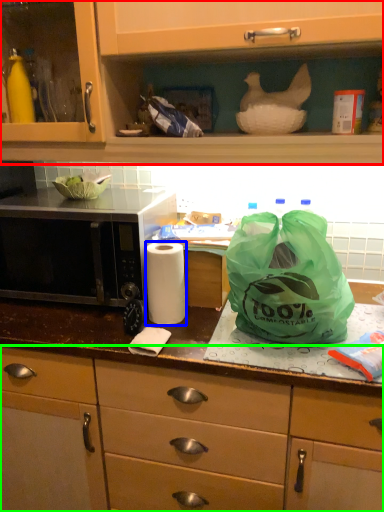
Question: Which object is the farthest from cabinetry (highlighted by a red box)? Choose among these: paper towel (highlighted by a blue box) or cabinetry (highlighted by a green box).

Choices:
 (A) paper towel
 (B) cabinetry

Answer: (B)